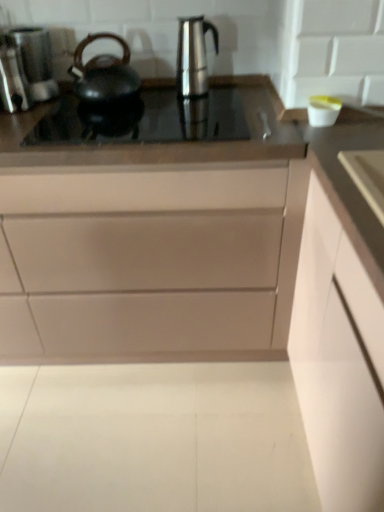
Where is `free location in front of polished stainless steel coffee machine at left`? The width and height of the screenshot is (384, 512). free location in front of polished stainless steel coffee machine at left is located at coordinates (40, 115).